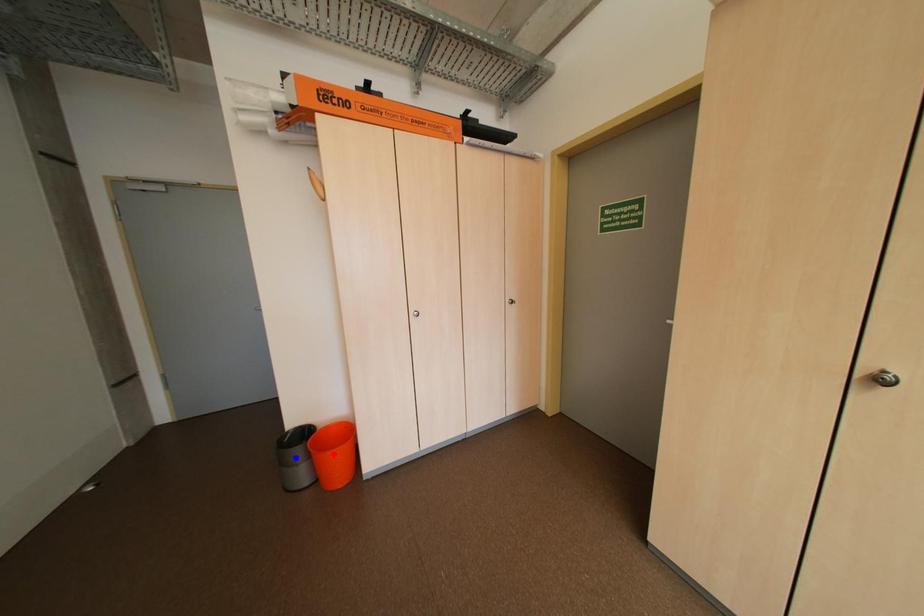
Question: Which of the two points in the image is closer to the camera?

Choices:
 (A) Blue point is closer.
 (B) Red point is closer.

Answer: (B)